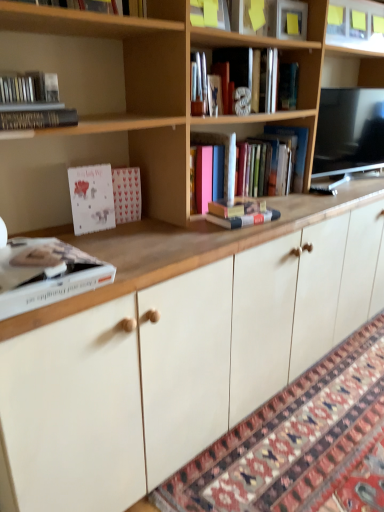
You are a GUI agent. You are given a task and a screenshot of the screen. Output one action in this format:
    pyautogui.click(x=<x>, y=<y>)
    Task: Click on the free space in front of hardcover book at center, which is the third book from right to left
    This screenshot has height=512, width=384.
    Given the screenshot: What is the action you would take?
    pyautogui.click(x=233, y=230)